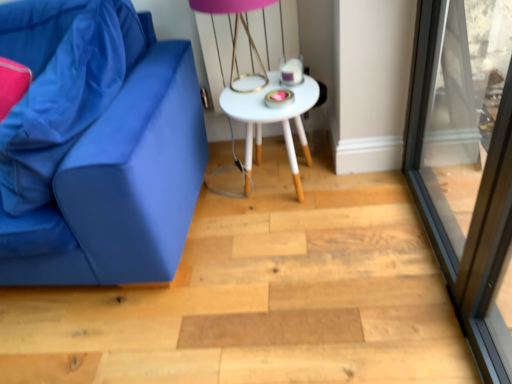
Question: From the image's perspective, would you say matte blue fabric pillow at left is shown under pink matte table lamp at upper center?

Choices:
 (A) yes
 (B) no

Answer: (A)

Question: Is matte blue fabric pillow at left turned away from pink matte table lamp at upper center?

Choices:
 (A) yes
 (B) no

Answer: (A)

Question: Is matte blue fabric pillow at left thinner than pink matte table lamp at upper center?

Choices:
 (A) no
 (B) yes

Answer: (B)

Question: Considering the relative sizes of matte blue fabric pillow at left and pink matte table lamp at upper center in the image provided, is matte blue fabric pillow at left smaller than pink matte table lamp at upper center?

Choices:
 (A) no
 (B) yes

Answer: (A)

Question: Does matte blue fabric pillow at left have a greater width compared to pink matte table lamp at upper center?

Choices:
 (A) yes
 (B) no

Answer: (B)

Question: Is matte blue fabric pillow at left positioned far away from pink matte table lamp at upper center?

Choices:
 (A) no
 (B) yes

Answer: (A)

Question: Does matte blue couch at left have a larger size compared to transparent glass screen door at right?

Choices:
 (A) yes
 (B) no

Answer: (A)

Question: From a real-world perspective, is matte blue couch at left positioned over transparent glass screen door at right based on gravity?

Choices:
 (A) yes
 (B) no

Answer: (B)

Question: Is matte blue couch at left facing away from transparent glass screen door at right?

Choices:
 (A) no
 (B) yes

Answer: (A)

Question: Is matte blue couch at left in front of transparent glass screen door at right?

Choices:
 (A) no
 (B) yes

Answer: (A)

Question: From the image's perspective, is matte blue couch at left under transparent glass screen door at right?

Choices:
 (A) yes
 (B) no

Answer: (B)

Question: Considering the relative positions of matte blue couch at left and transparent glass screen door at right in the image provided, is matte blue couch at left to the right of transparent glass screen door at right from the viewer's perspective?

Choices:
 (A) yes
 (B) no

Answer: (B)

Question: Can you confirm if matte blue couch at left is bigger than white matte table at center?

Choices:
 (A) no
 (B) yes

Answer: (B)